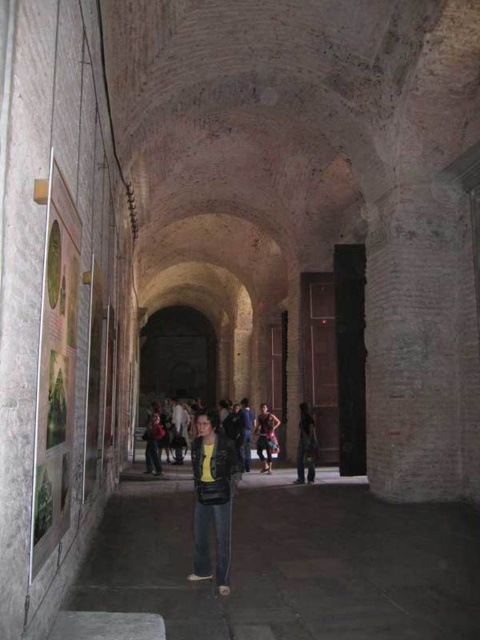
You are standing in the corridor and want to place a new decorative item at the same location as the denim jeans at center. What are the coordinates where you should place it?

You should place the decorative item at the coordinates point (290, 563) where the denim jeans at center is located.

You are standing in the corridor and see both the leather jacket at center and the dark blue jeans at center. Which one is positioned to the left from your perspective?

The leather jacket at center is to the left of the dark blue jeans at center.